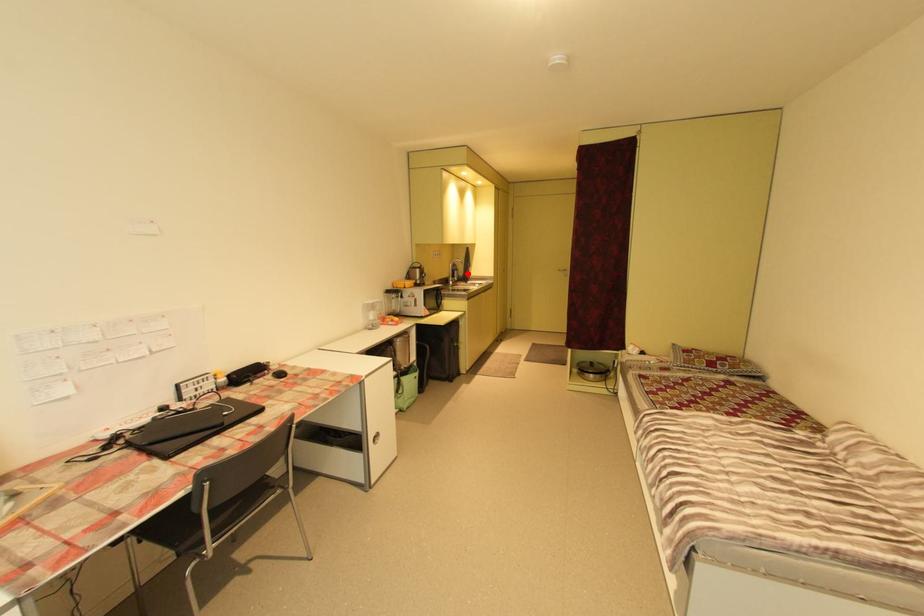
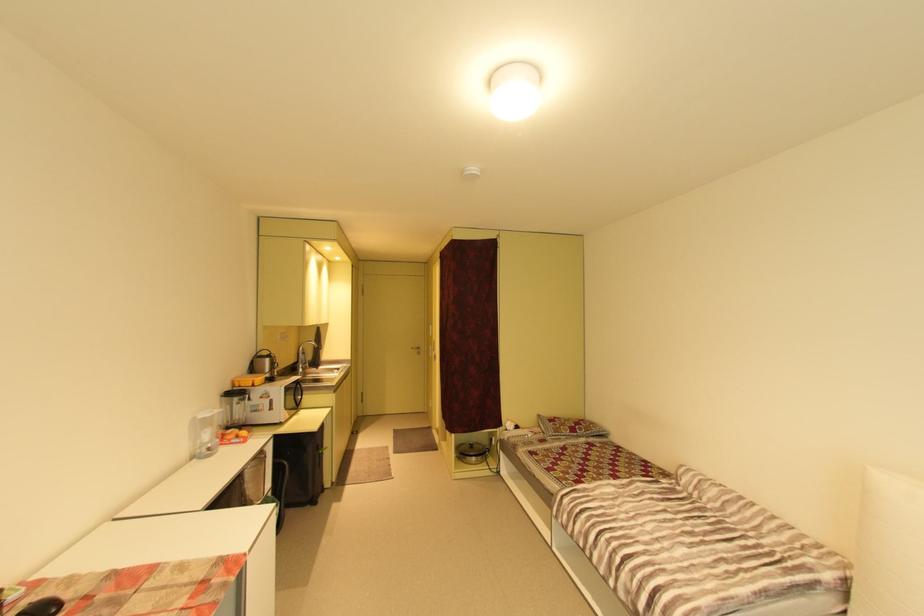
In the second image, find the point that corresponds to the highlighted location in the first image.

(317, 358)